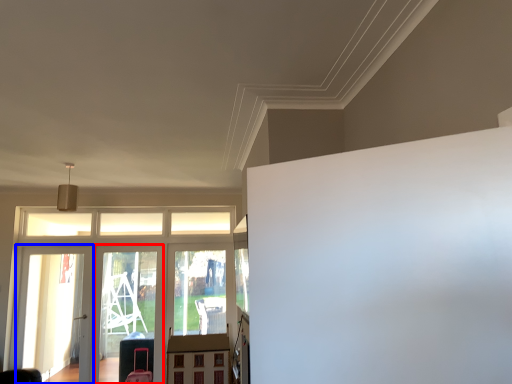
Question: Which of the following is the closest to the observer, screen door (highlighted by a red box) or screen door (highlighted by a blue box)?

Choices:
 (A) screen door
 (B) screen door

Answer: (B)